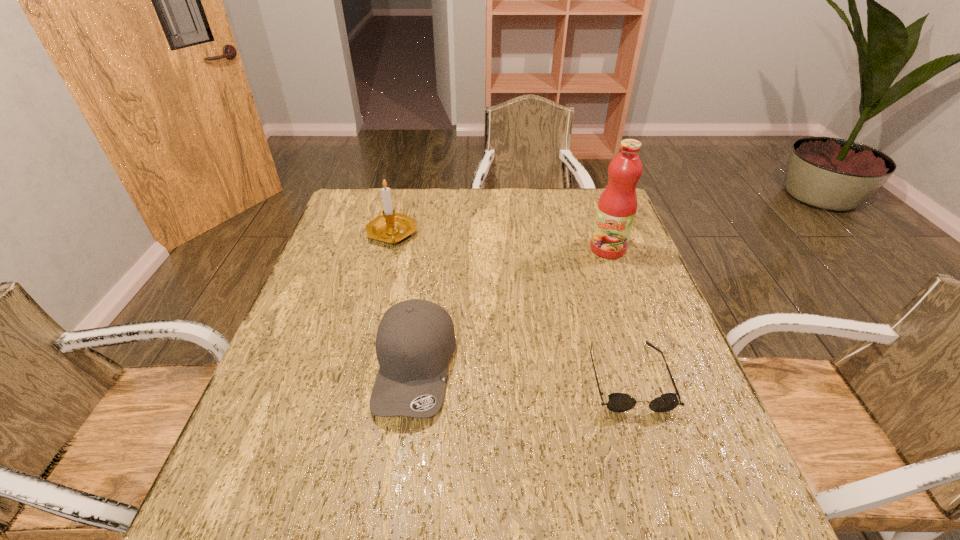
In the image, there is a desktop. Where is `free space at the near left corner`? Image resolution: width=960 pixels, height=540 pixels. free space at the near left corner is located at coordinates (271, 429).

Locate an element on the screen. blank space at the far right corner of the desktop is located at coordinates (572, 208).

Identify the location of free location at the near right corner of the desktop. This screenshot has height=540, width=960. (691, 470).

Where is `vacant area that lies between the shortest object and the fruit juice`? This screenshot has height=540, width=960. vacant area that lies between the shortest object and the fruit juice is located at coordinates (618, 313).

Where is `free space between the second shortest object and the sunglasses`? free space between the second shortest object and the sunglasses is located at coordinates (522, 372).

Image resolution: width=960 pixels, height=540 pixels. I want to click on vacant area that lies between the third shortest object and the shortest object, so click(510, 306).

This screenshot has width=960, height=540. What are the coordinates of `free area in between the baseball cap and the shortest object` in the screenshot? It's located at (522, 372).

You are a GUI agent. You are given a task and a screenshot of the screen. Output one action in this format:
    pyautogui.click(x=<x>, y=<y>)
    Task: Click on the empty space that is in between the candle holder and the baseball cap
    This screenshot has width=960, height=540.
    Given the screenshot: What is the action you would take?
    pyautogui.click(x=403, y=301)

I want to click on free space between the third tallest object and the candle holder, so click(x=403, y=301).

Identify the location of vacant space that is in between the baseball cap and the shortest object. This screenshot has width=960, height=540. (522, 372).